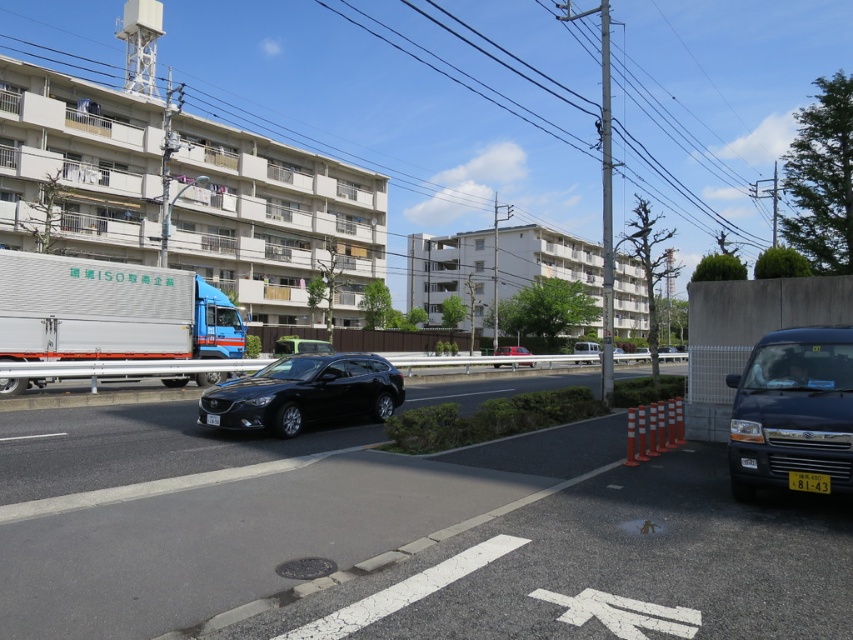
Question: In this image, where is black glossy sedan at center located relative to yellow plastic license plate at center?

Choices:
 (A) below
 (B) above

Answer: (A)

Question: Does black matte hatchback at center appear on the left side of black glossy sedan at center?

Choices:
 (A) no
 (B) yes

Answer: (B)

Question: Among these points, which one is farthest from the camera?

Choices:
 (A) (248, 413)
 (B) (792, 472)
 (C) (769, 392)
 (D) (200, 284)

Answer: (D)

Question: Which point is closer to the camera?

Choices:
 (A) yellow plastic license plate at center
 (B) matte red car at center
 (C) metallic blue van at right

Answer: (C)

Question: Observing the image, what is the correct spatial positioning of metallic blue van at right in reference to black matte hatchback at center?

Choices:
 (A) right
 (B) left

Answer: (A)

Question: Which object appears closest to the camera in this image?

Choices:
 (A) metallic blue van at right
 (B) black matte hatchback at center

Answer: (A)